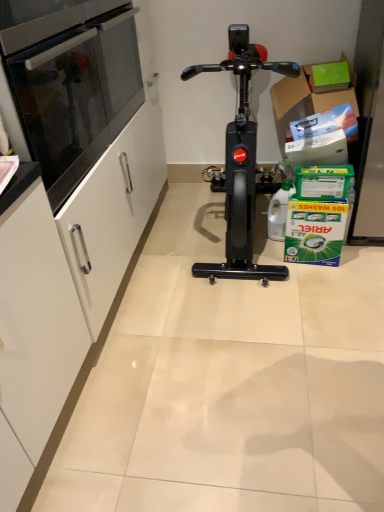
Question: From a real-world perspective, is black granite countertop at left physically below green cardboard box at upper right?

Choices:
 (A) yes
 (B) no

Answer: (B)

Question: Is black granite countertop at left with green cardboard box at upper right?

Choices:
 (A) yes
 (B) no

Answer: (B)

Question: From the image's perspective, would you say black granite countertop at left is shown under green cardboard box at upper right?

Choices:
 (A) no
 (B) yes

Answer: (B)

Question: Is black granite countertop at left taller than green cardboard box at upper right?

Choices:
 (A) no
 (B) yes

Answer: (A)

Question: Considering the relative sizes of black granite countertop at left and green cardboard box at upper right in the image provided, is black granite countertop at left smaller than green cardboard box at upper right?

Choices:
 (A) no
 (B) yes

Answer: (B)

Question: From the image's perspective, would you say black granite countertop at left is positioned over green cardboard box at upper right?

Choices:
 (A) yes
 (B) no

Answer: (B)

Question: Considering the relative positions of black glass oven at left and green cardboard box at upper right in the image provided, is black glass oven at left in front of green cardboard box at upper right?

Choices:
 (A) no
 (B) yes

Answer: (B)

Question: Does black glass oven at left turn towards green cardboard box at upper right?

Choices:
 (A) no
 (B) yes

Answer: (A)

Question: Considering the relative sizes of black glass oven at left and green cardboard box at upper right in the image provided, is black glass oven at left wider than green cardboard box at upper right?

Choices:
 (A) no
 (B) yes

Answer: (B)

Question: Is there a large distance between black glass oven at left and green cardboard box at upper right?

Choices:
 (A) no
 (B) yes

Answer: (B)

Question: From a real-world perspective, does black glass oven at left stand above green cardboard box at upper right?

Choices:
 (A) no
 (B) yes

Answer: (B)

Question: Is green cardboard box at upper right completely or partially inside black glass oven at left?

Choices:
 (A) no
 (B) yes

Answer: (A)

Question: Is black glass oven at left smaller than black granite countertop at left?

Choices:
 (A) yes
 (B) no

Answer: (B)